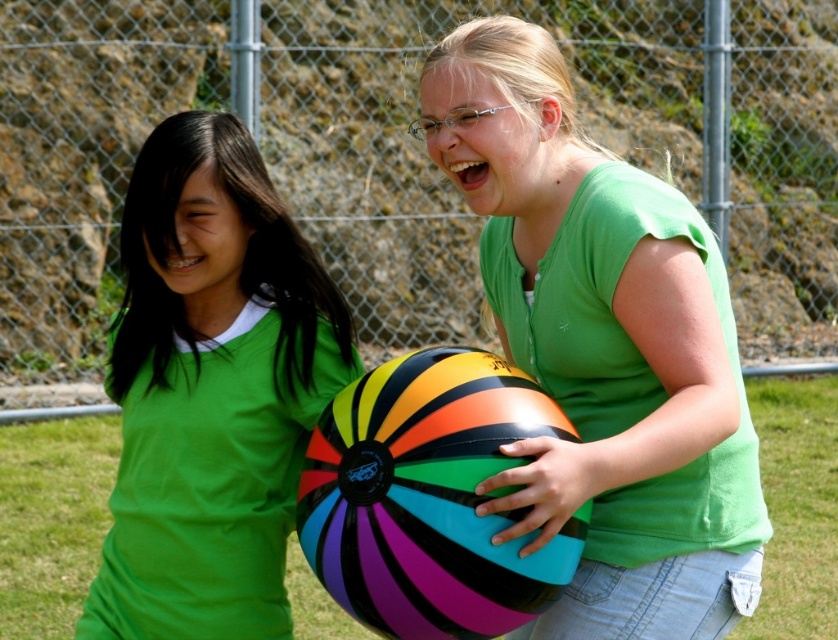
Question: Among these objects, which one is farthest from the camera?

Choices:
 (A) green matte shirt at center
 (B) rainbow glossy beach ball at center

Answer: (A)

Question: Is green matte shirt at center to the left of rainbow glossy beach ball at center from the viewer's perspective?

Choices:
 (A) no
 (B) yes

Answer: (B)

Question: Which object appears farthest from the camera in this image?

Choices:
 (A) rainbow glossy beach ball at center
 (B) rubberized multicolored ball at center

Answer: (A)

Question: Observing the image, what is the correct spatial positioning of rubberized multicolored ball at center in reference to rainbow glossy beach ball at center?

Choices:
 (A) right
 (B) left

Answer: (A)

Question: Is rubberized multicolored ball at center thinner than rainbow glossy beach ball at center?

Choices:
 (A) yes
 (B) no

Answer: (B)

Question: Based on their relative distances, which object is nearer to the green matte shirt at center?

Choices:
 (A) rubberized multicolored ball at center
 (B) rainbow glossy beach ball at center

Answer: (B)